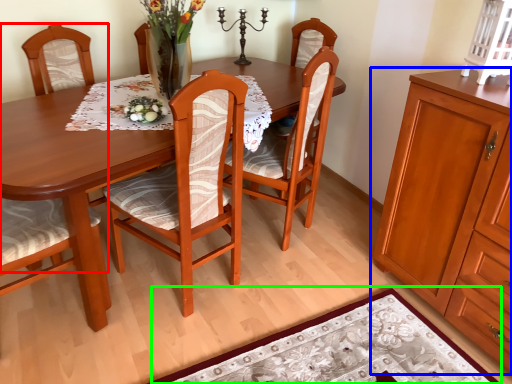
Question: Which object is positioned closest to chair (highlighted by a red box)? Select from cabinetry (highlighted by a blue box) and place mat (highlighted by a green box).

Choices:
 (A) cabinetry
 (B) place mat

Answer: (B)